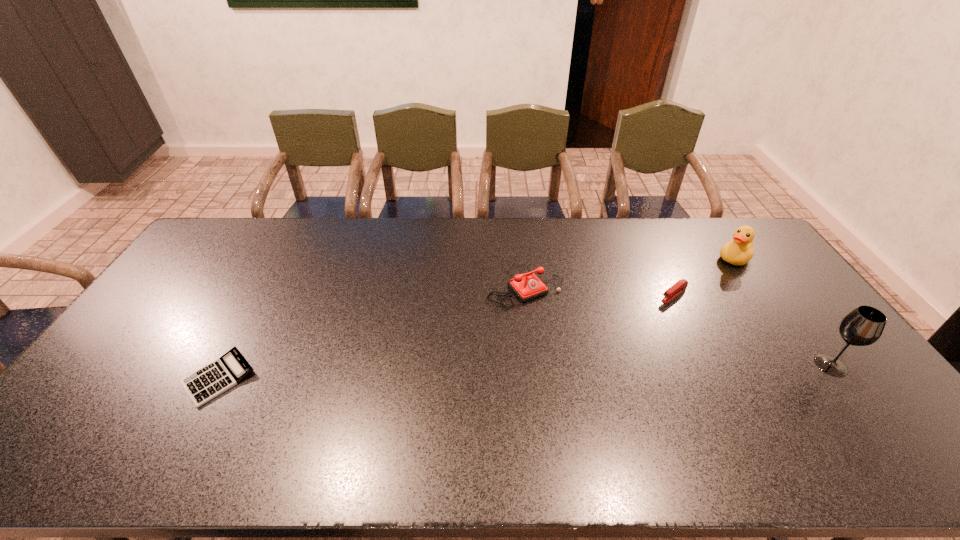
This screenshot has width=960, height=540. Identify the location of blank region between the duck and the wineglass. (782, 312).

What are the coordinates of `free area in between the fourth tallest object and the third shortest object` in the screenshot? It's located at (600, 289).

At what (x,y) coordinates should I click in order to perform the action: click on free area in between the calculator and the telephone. Please return your answer as a coordinate pair (x, y). Image resolution: width=960 pixels, height=540 pixels. Looking at the image, I should click on (372, 332).

Locate an element on the screen. free space between the tallest object and the leftmost object is located at coordinates (525, 372).

I want to click on vacant point located between the fourth object from right to left and the calculator, so click(x=372, y=332).

What are the coordinates of `unoccupied position between the stapler and the telephone` in the screenshot? It's located at (600, 289).

The width and height of the screenshot is (960, 540). I want to click on vacant space that's between the duck and the second shortest object, so click(705, 276).

What are the coordinates of `unoccupied area between the stapler and the wineglass` in the screenshot? It's located at (753, 330).

Where is `free space between the third tallest object and the duck`? free space between the third tallest object and the duck is located at coordinates (630, 272).

Where is `free space between the calculator and the fourth object from right to left`? This screenshot has width=960, height=540. free space between the calculator and the fourth object from right to left is located at coordinates (372, 332).